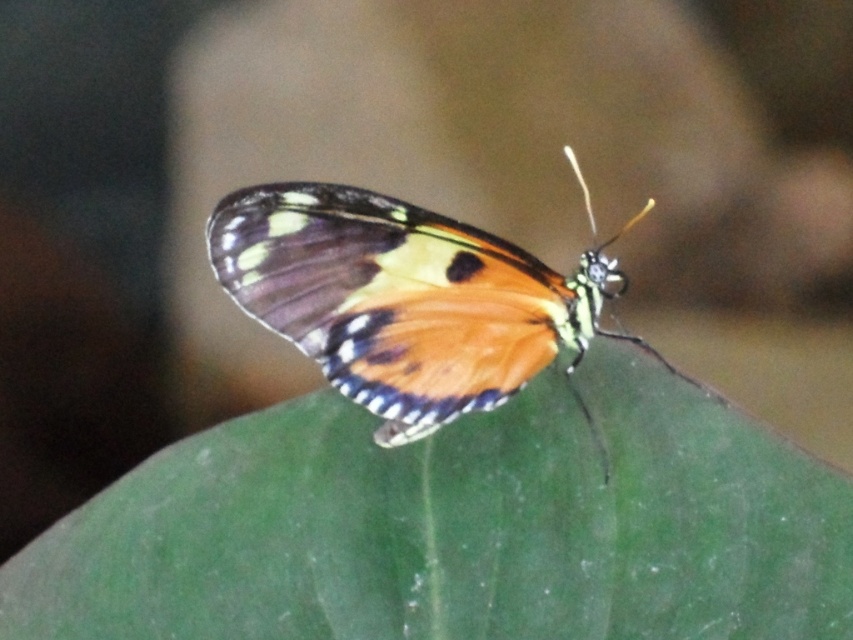
Question: Observing the image, what is the correct spatial positioning of green matte leaf at center in reference to shiny orange butterfly at center?

Choices:
 (A) left
 (B) right

Answer: (A)

Question: Which point is farther to the camera?

Choices:
 (A) [x=409, y=362]
 (B) [x=782, y=579]

Answer: (A)

Question: Which point is farther to the camera?

Choices:
 (A) green matte leaf at center
 (B) shiny orange butterfly at center

Answer: (B)

Question: Does green matte leaf at center have a greater width compared to shiny orange butterfly at center?

Choices:
 (A) no
 (B) yes

Answer: (B)

Question: Can you confirm if green matte leaf at center is bigger than shiny orange butterfly at center?

Choices:
 (A) yes
 (B) no

Answer: (A)